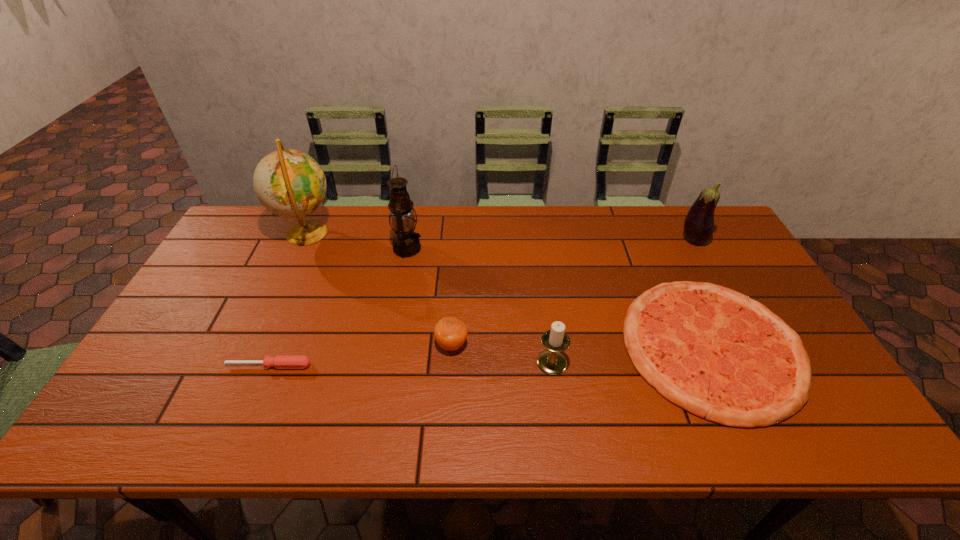
You are a GUI agent. You are given a task and a screenshot of the screen. Output one action in this format:
    pyautogui.click(x=<x>, y=<y>)
    Task: Click on the vacant position at the far right corner of the desktop
    This screenshot has height=540, width=960.
    Given the screenshot: What is the action you would take?
    pyautogui.click(x=717, y=240)

At what (x,y) coordinates should I click in order to perform the action: click on vacant space that is in between the fifth tallest object and the fifth object from left to right. Please return your answer as a coordinate pair (x, y). The image size is (960, 540). Looking at the image, I should click on (502, 353).

This screenshot has height=540, width=960. I want to click on vacant area that lies between the shortest object and the orange, so coord(360,355).

Find the location of `free space between the oil lamp and the fourth shortest object`. free space between the oil lamp and the fourth shortest object is located at coordinates (480, 306).

Find the location of `vacant area that lies between the globe and the pizza`. vacant area that lies between the globe and the pizza is located at coordinates (510, 289).

Where is `vacant area that lies between the fifth object from left to right and the screwdriver`? Image resolution: width=960 pixels, height=540 pixels. vacant area that lies between the fifth object from left to right and the screwdriver is located at coordinates (411, 364).

The width and height of the screenshot is (960, 540). I want to click on vacant area that lies between the fifth tallest object and the candle holder, so click(502, 353).

Where is `blank region between the globe and the fourth object from right to left`? The width and height of the screenshot is (960, 540). blank region between the globe and the fourth object from right to left is located at coordinates [379, 288].

Where is `vacant area that lies between the screwdriver and the pizza`? vacant area that lies between the screwdriver and the pizza is located at coordinates (491, 356).

I want to click on blank region between the third object from left to right and the pizza, so click(560, 298).